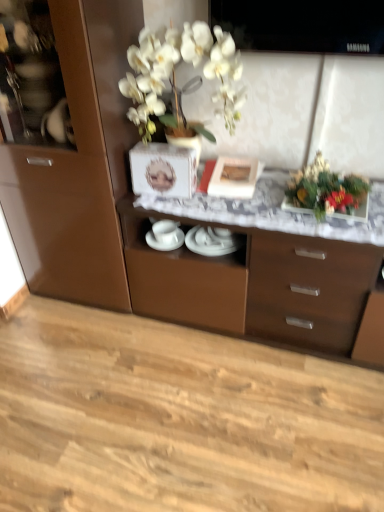
At what (x,y) coordinates should I click in order to perform the action: click on free region on the left part of shiny metallic vase at upper right. Please return your answer as a coordinate pair (x, y). Looking at the image, I should click on (254, 202).